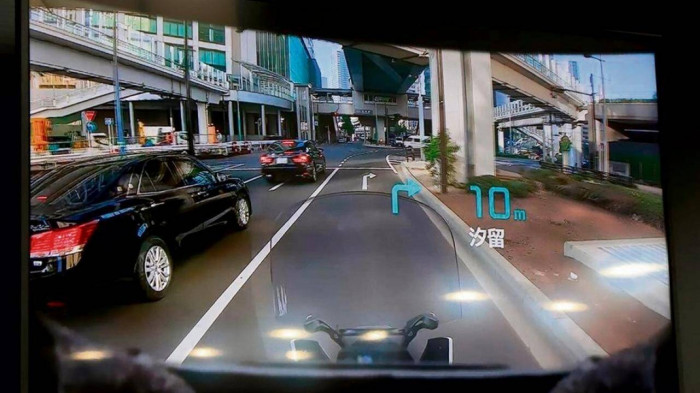
I want to click on light reflections, so click(101, 350), click(197, 351), click(290, 336), click(297, 354), click(370, 334), click(635, 275).